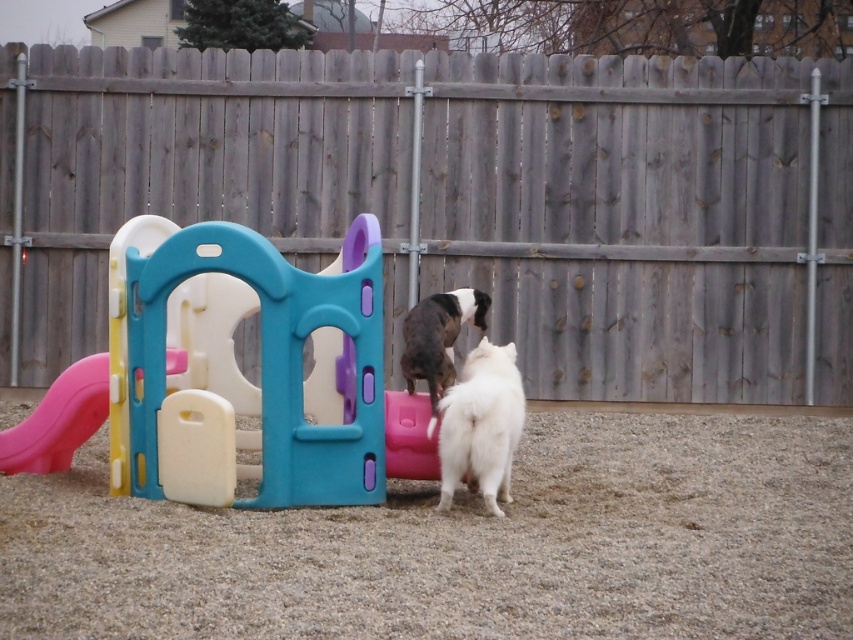
You are a small dog with a width of 20 cm. You want to pass through the space between the pink plastic slide at lower left and the black and white fur at center. Can you fit through the narrowest point of that space?

The pink plastic slide at lower left is wider than the black and white fur at center. The narrowest point between them would depend on their positions, but since the slide is wider, it might create a passage narrower than 20 cm. However, without exact distance, it is uncertain. Please check the actual space.

What is the coordinate of the pink plastic slide at lower left?

The pink plastic slide at lower left is located at coordinate point (59, 419).

You are standing in the backyard looking at the play structure and the two dogs. If you want to throw a ball to the point marked as point (393,204), which is 12.49 meters away, can you estimate whether the ball will land closer to the play structure or the white dog?

The point marked as point (393,204) is 12.49 meters away from the viewer. Since the play structure is part of the scene and the white dog is near it, but without specific distances for the play structure or the dog, it is impossible to determine which is closer to the point.